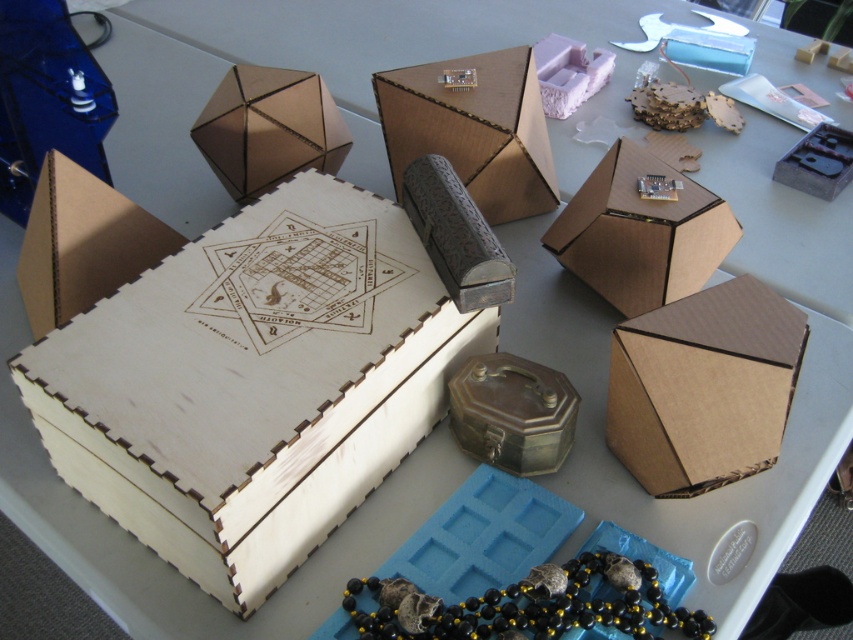
Question: Can you confirm if brown cardboard box at center-right is positioned above brown cardboard box at center?

Choices:
 (A) yes
 (B) no

Answer: (B)

Question: Which point is closer to the camera taking this photo?

Choices:
 (A) (637, 157)
 (B) (415, 99)

Answer: (A)

Question: Can you confirm if brown cardboard box at center-right is positioned to the right of brown cardboard box at center?

Choices:
 (A) no
 (B) yes

Answer: (B)

Question: Which of the following is the closest to the observer?

Choices:
 (A) (506, 218)
 (B) (248, 392)
 (C) (230, 157)
 (D) (718, 291)

Answer: (B)

Question: Which object is closer to the camera taking this photo?

Choices:
 (A) matte cardboard box at center
 (B) matte cardboard box at upper left
 (C) natural wood box at center
 (D) brown cardboard box at center

Answer: (C)

Question: Can you confirm if brown cardboard box at center-right is thinner than brown cardboard box at center?

Choices:
 (A) yes
 (B) no

Answer: (A)